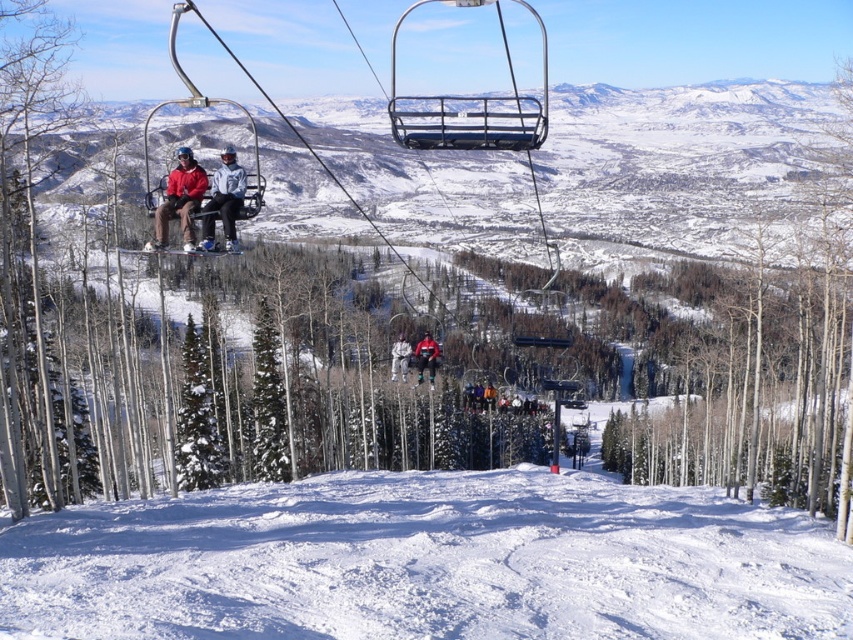
You are a winter sports enthusiast planning to ski down the slope. You want to know the location of the white powdery snow at lower center. Where exactly is it located?

The white powdery snow at lower center is located at point (426,563).

You are a photographer trying to capture a clear photo of both the matte red jacket at upper center and the red fabric jacket at center. However, the ski lift is moving, and you can only focus on one jacket at a time. Which jacket should you focus on first to ensure the other remains in the frame?

You should focus on the matte red jacket at upper center first because it is positioned over the red fabric jacket at center, meaning it is closer to the camera. By focusing on the closer jacket first, you can adjust the camera to keep the background jacket in the frame as the lift moves.

You are standing at the point labeled point [181,177] and want to walk to the point labeled point [433,353]. Which direction should you move relative to the ski lift system?

You should move towards the back of the ski lift system because point [181,177] is in front of point [433,353].